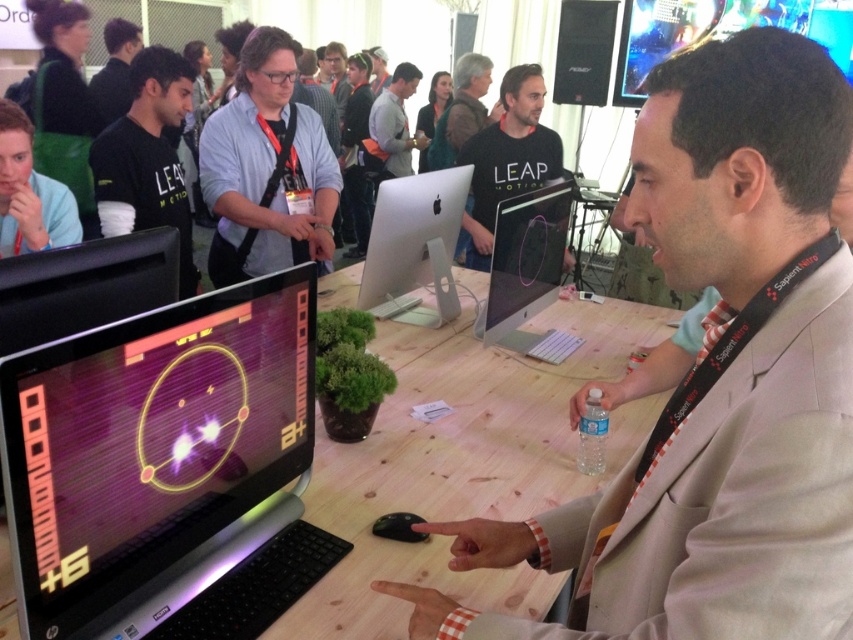
You are standing at the tech expo and see two points on the computer screen. The first point is at coordinates point (705,243) and the second is at point (49,444). Which point is closer to you?

The point at coordinates point (705,243) is closer to you than the point at point (49,444).

You are standing at the entrance of the event and want to locate the beige suit at center. What are the coordinates where you should look to find it?

The beige suit at center is located at coordinates point [717,380].